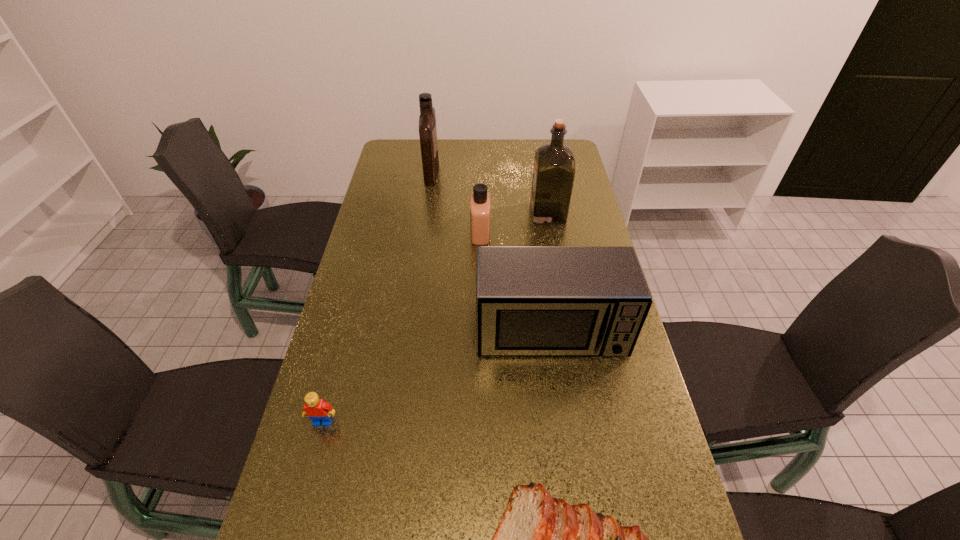
At what (x,y) coordinates should I click in order to perform the action: click on microwave_oven at the right edge. Please return your answer as a coordinate pair (x, y). Looking at the image, I should click on (530, 300).

Locate an element on the screen. The width and height of the screenshot is (960, 540). vacant space at the far edge of the desktop is located at coordinates (450, 143).

In the image, there is a desktop. Where is `free space at the left edge`? free space at the left edge is located at coordinates (372, 400).

This screenshot has width=960, height=540. Find the location of `vacant space at the right edge of the desktop`. vacant space at the right edge of the desktop is located at coordinates (582, 381).

Image resolution: width=960 pixels, height=540 pixels. In order to click on free location at the far left corner in this screenshot , I will do `click(420, 139)`.

Locate an element on the screen. The height and width of the screenshot is (540, 960). empty location between the nearer liquor and the farther liquor is located at coordinates (490, 193).

This screenshot has width=960, height=540. Identify the location of vacant space that is in between the third shortest object and the leftmost object. (401, 327).

This screenshot has height=540, width=960. Identify the location of object that can be found as the fourth closest to the fourth farthest object. (554, 163).

I want to click on the third closest object to the fourth shortest object, so click(317, 410).

Where is `free point that satisfies the following two spatial constraints: 1. on the label of the nearer liquor; 2. on the face of the leftmost object`? free point that satisfies the following two spatial constraints: 1. on the label of the nearer liquor; 2. on the face of the leftmost object is located at coordinates (586, 421).